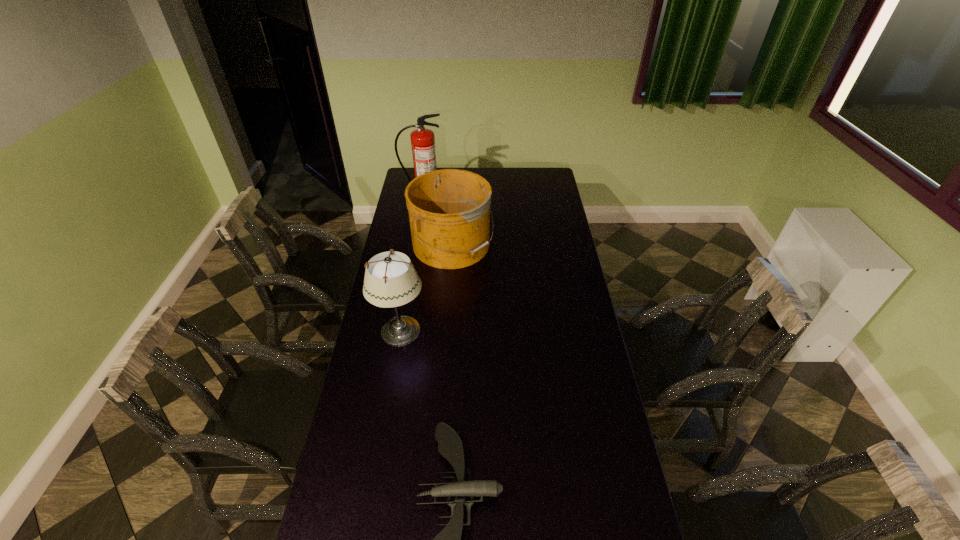
The width and height of the screenshot is (960, 540). What are the coordinates of `object that ranks as the closest to the third farthest object` in the screenshot? It's located at (449, 210).

Locate which object ranks second in proximity to the drone. Please provide its 2D coordinates. Your answer should be formatted as a tuple, i.e. [(x, y)], where the tuple contains the x and y coordinates of a point satisfying the conditions above.

[(449, 210)]

At what (x,y) coordinates should I click in order to perform the action: click on blank space that satisfies the following two spatial constraints: 1. on the front-facing side of the third tallest object; 2. on the right side of the tallest object. Please return your answer as a coordinate pair (x, y). This screenshot has width=960, height=540. Looking at the image, I should click on (414, 245).

The height and width of the screenshot is (540, 960). What are the coordinates of `free space in the image that satisfies the following two spatial constraints: 1. on the front side of the second farthest object; 2. on the lampshade of the lampshade` in the screenshot? It's located at (446, 332).

Locate an element on the screen. The height and width of the screenshot is (540, 960). vacant space that satisfies the following two spatial constraints: 1. on the front-facing side of the second farthest object; 2. on the left side of the fire extinguisher is located at coordinates (414, 245).